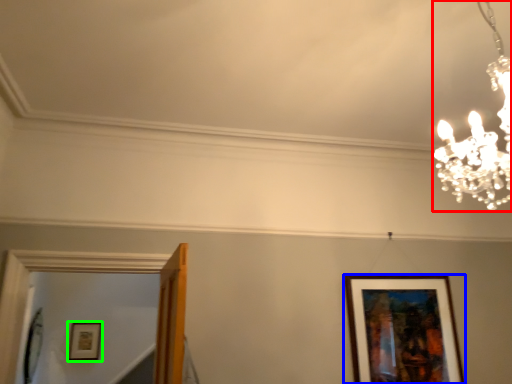
Question: Which object is positioned closest to lamp (highlighted by a red box)? Select from picture frame (highlighted by a blue box) and picture frame (highlighted by a green box).

Choices:
 (A) picture frame
 (B) picture frame

Answer: (A)